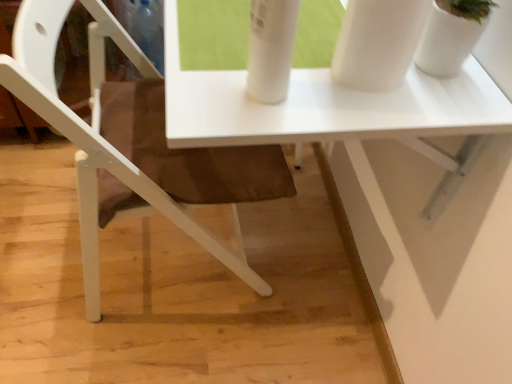
What is the approximate height of white matte chair at lower left?

78.78 centimeters.

The width and height of the screenshot is (512, 384). What do you see at coordinates (134, 144) in the screenshot?
I see `white matte chair at lower left` at bounding box center [134, 144].

Image resolution: width=512 pixels, height=384 pixels. Identify the location of white glossy table at center. point(391,196).

Is the position of white matte chair at lower left more distant than that of white glossy table at center?

No, it is in front of white glossy table at center.

From a real-world perspective, which object stands above the other?

white glossy table at center is physically above.

Considering the sizes of objects white matte chair at lower left and white glossy table at center in the image provided, who is bigger, white matte chair at lower left or white glossy table at center?

white matte chair at lower left.

From the image's perspective, is white matte chair at lower left on top of white glossy table at center?

No, from the image's perspective, white matte chair at lower left is not over white glossy table at center.

Are white glossy vase at upper right and white matte chair at lower left making contact?

No, white glossy vase at upper right is not beside white matte chair at lower left.

From the image's perspective, which is below, white glossy vase at upper right or white matte chair at lower left?

white matte chair at lower left is shown below in the image.

Considering the sizes of white glossy vase at upper right and white matte chair at lower left in the image, is white glossy vase at upper right wider or thinner than white matte chair at lower left?

white glossy vase at upper right is thinner than white matte chair at lower left.

Can you confirm if white glossy vase at upper right is positioned to the left of white matte chair at lower left?

No, white glossy vase at upper right is not to the left of white matte chair at lower left.

Looking at this image, between white glossy table at center and white glossy vase at upper right, which one is positioned behind?

white glossy table at center is further from the camera.

Which of these two, white glossy table at center or white glossy vase at upper right, is thinner?

Thinner between the two is white glossy vase at upper right.

From the image's perspective, is white glossy table at center positioned above or below white glossy vase at upper right?

Based on their image positions, white glossy table at center is located beneath white glossy vase at upper right.

Which object is positioned more to the left, white glossy table at center or white glossy vase at upper right?

white glossy table at center.

Which is more to the left, white glossy table at center or white matte chair at lower left?

Positioned to the left is white matte chair at lower left.

Would you say white glossy table at center is inside or outside white matte chair at lower left?

white glossy table at center lies within the bounds of white matte chair at lower left.

Is white glossy table at center oriented towards white matte chair at lower left?

Yes, white glossy table at center is turned towards white matte chair at lower left.

Is white glossy table at center smaller than white matte chair at lower left?

Correct, white glossy table at center occupies less space than white matte chair at lower left.

From a real-world perspective, who is located lower, white matte chair at lower left or white glossy vase at upper right?

white matte chair at lower left.

Who is bigger, white matte chair at lower left or white glossy vase at upper right?

white matte chair at lower left.

Which of these two, white matte chair at lower left or white glossy vase at upper right, stands shorter?

With less height is white glossy vase at upper right.

Is point (116, 24) farther from viewer compared to point (449, 27)?

Yes.

From the image's perspective, who appears lower, white glossy vase at upper right or white glossy table at center?

white glossy table at center is shown below in the image.

Is white glossy vase at upper right oriented towards white glossy table at center?

No, white glossy vase at upper right is not oriented towards white glossy table at center.

Which is more distant, [482,9] or [390,231]?

Positioned behind is point [390,231].

How different are the orientations of white glossy vase at upper right and white glossy table at center in degrees?

178 degrees.

Locate an element on the screen. table behind the white matte chair at lower left is located at coordinates (391, 196).

Image resolution: width=512 pixels, height=384 pixels. I want to click on glass vase above the white matte chair at lower left (from the image's perspective), so click(x=451, y=35).

Estimate the real-world distances between objects in this image. Which object is further from white matte chair at lower left, white glossy table at center or white glossy vase at upper right?

Among the two, white glossy vase at upper right is located further to white matte chair at lower left.

From the image, which object appears to be farther from white glossy table at center, white matte chair at lower left or white glossy vase at upper right?

Based on the image, white glossy vase at upper right appears to be further to white glossy table at center.

Consider the image. When comparing their distances from white glossy vase at upper right, does white glossy table at center or white matte chair at lower left seem further?

white matte chair at lower left lies further to white glossy vase at upper right than the other object.

In the scene shown: Estimate the real-world distances between objects in this image. Which object is further from white matte chair at lower left, white glossy vase at upper right or white glossy table at center?

white glossy vase at upper right is positioned further to the anchor white matte chair at lower left.

Considering their positions, is white glossy vase at upper right positioned closer to white glossy table at center than white matte chair at lower left?

white matte chair at lower left.

When comparing their distances from white glossy vase at upper right, does white matte chair at lower left or white glossy table at center seem further?

white matte chair at lower left is further to white glossy vase at upper right.

This screenshot has height=384, width=512. I want to click on table between white matte chair at lower left and white glossy vase at upper right in the horizontal direction, so click(391, 196).